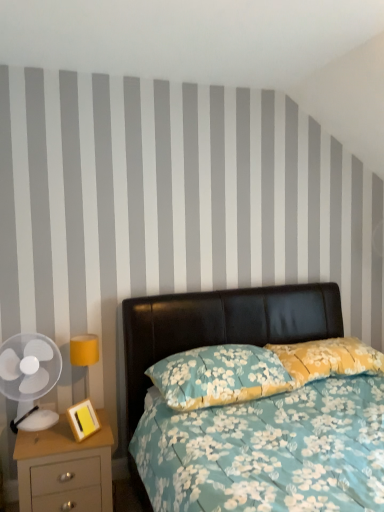
Question: Does floral fabric pillow at center, the first pillow viewed from the right, have a lesser width compared to transparent plastic fan at left?

Choices:
 (A) yes
 (B) no

Answer: (B)

Question: Is floral fabric pillow at center, the second pillow from the left, behind transparent plastic fan at left?

Choices:
 (A) yes
 (B) no

Answer: (A)

Question: Considering the relative positions of floral fabric pillow at center, the first pillow viewed from the right, and transparent plastic fan at left in the image provided, is floral fabric pillow at center, the first pillow viewed from the right, to the right of transparent plastic fan at left from the viewer's perspective?

Choices:
 (A) yes
 (B) no

Answer: (A)

Question: Considering the relative sizes of floral fabric pillow at center, the second pillow from the left, and transparent plastic fan at left in the image provided, is floral fabric pillow at center, the second pillow from the left, smaller than transparent plastic fan at left?

Choices:
 (A) yes
 (B) no

Answer: (B)

Question: From a real-world perspective, is floral fabric pillow at center, the second pillow from the left, on top of transparent plastic fan at left?

Choices:
 (A) yes
 (B) no

Answer: (A)

Question: Is floral fabric pillow at center, the first pillow viewed from the right, placed right next to transparent plastic fan at left?

Choices:
 (A) no
 (B) yes

Answer: (A)

Question: From a real-world perspective, is floral fabric pillow at center, placed as the 2th pillow when sorted from right to left, positioned under floral fabric pillow at center, the second pillow from the left, based on gravity?

Choices:
 (A) no
 (B) yes

Answer: (B)

Question: Does floral fabric pillow at center, which is the first pillow from left to right, have a greater height compared to floral fabric pillow at center, the first pillow viewed from the right?

Choices:
 (A) yes
 (B) no

Answer: (A)

Question: From a real-world perspective, is floral fabric pillow at center, placed as the 2th pillow when sorted from right to left, positioned over floral fabric pillow at center, the first pillow viewed from the right, based on gravity?

Choices:
 (A) yes
 (B) no

Answer: (B)

Question: Is floral fabric pillow at center, placed as the 2th pillow when sorted from right to left, behind floral fabric pillow at center, the first pillow viewed from the right?

Choices:
 (A) yes
 (B) no

Answer: (B)

Question: Does floral fabric pillow at center, placed as the 2th pillow when sorted from right to left, turn towards floral fabric pillow at center, the second pillow from the left?

Choices:
 (A) yes
 (B) no

Answer: (B)

Question: Is floral fabric pillow at center, placed as the 2th pillow when sorted from right to left, placed right next to floral fabric pillow at center, the first pillow viewed from the right?

Choices:
 (A) no
 (B) yes

Answer: (A)

Question: From a real-world perspective, is floral fabric pillow at center, the second pillow from the left, located beneath floral fabric bed at center?

Choices:
 (A) yes
 (B) no

Answer: (B)